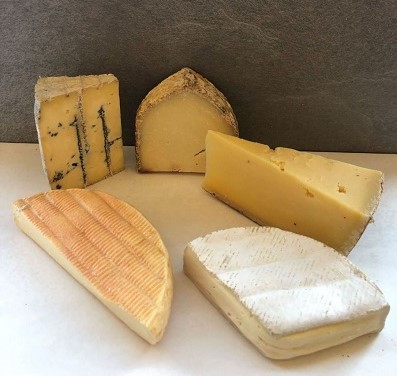
The image size is (397, 376). What are the coordinates of `wall` in the screenshot? It's located at (105, 15).